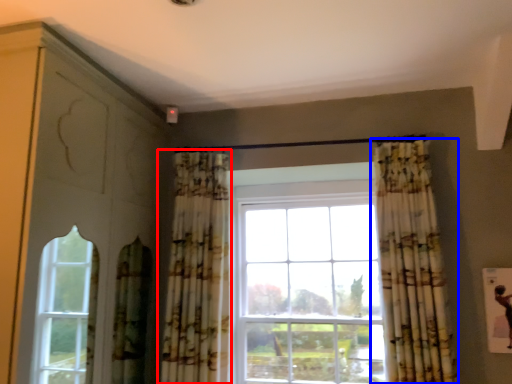
Question: Among these objects, which one is nearest to the camera, curtain (highlighted by a red box) or curtain (highlighted by a blue box)?

Choices:
 (A) curtain
 (B) curtain

Answer: (B)